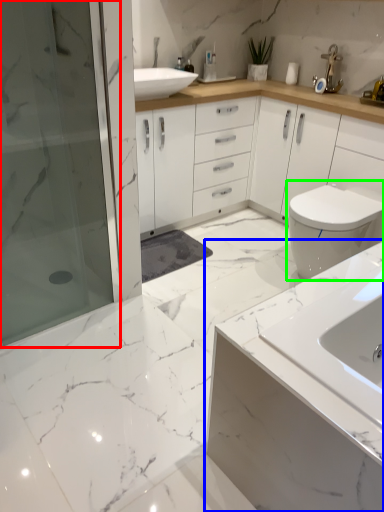
Question: Which object is positioned closest to shower door (highlighted by a red box)? Select from bathroom cabinet (highlighted by a blue box) and toilet (highlighted by a green box).

Choices:
 (A) bathroom cabinet
 (B) toilet

Answer: (B)